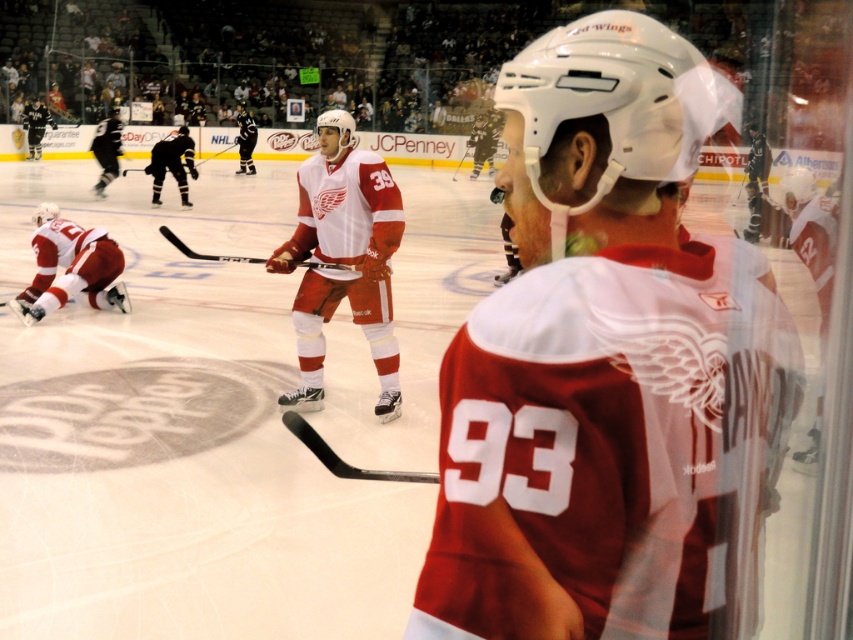
Question: Does black matte hockey stick at left appear on the left side of black jersey at left?

Choices:
 (A) no
 (B) yes

Answer: (A)

Question: Can you confirm if white jersey at center is wider than white jersey at left?

Choices:
 (A) no
 (B) yes

Answer: (B)

Question: Which object appears farthest from the camera in this image?

Choices:
 (A) white jersey at center
 (B) white matte jersey at center
 (C) black matte hockey stick at left

Answer: (B)

Question: Which point appears farthest from the camera in this image?

Choices:
 (A) (186, 248)
 (B) (51, 234)
 (C) (157, 172)
 (D) (572, 116)

Answer: (C)

Question: Is black jersey at left to the left of white matte jersey at center from the viewer's perspective?

Choices:
 (A) yes
 (B) no

Answer: (A)

Question: Which of the following is the farthest from the observer?

Choices:
 (A) pyautogui.click(x=247, y=116)
 (B) pyautogui.click(x=28, y=116)

Answer: (B)